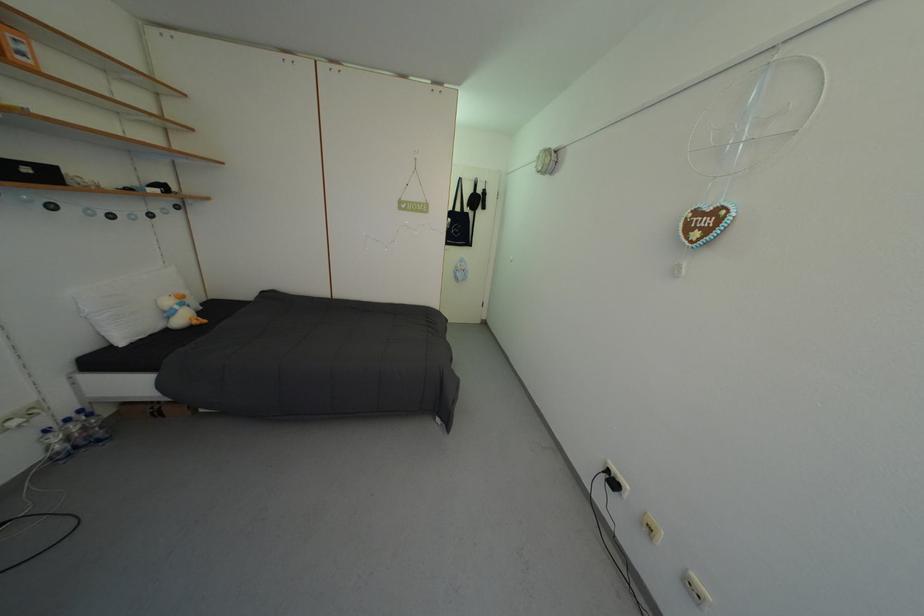
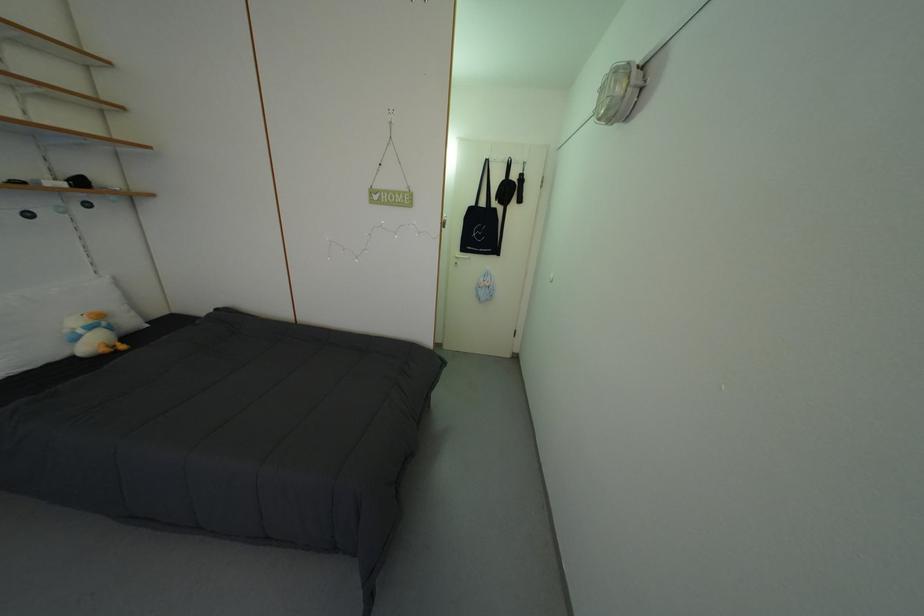
Question: The camera is either moving clockwise (left) or counter-clockwise (right) around the object. The first image is from the beginning of the video and the second image is from the end. Is the camera moving left or right when shooting the video?

Choices:
 (A) Left
 (B) Right

Answer: (B)